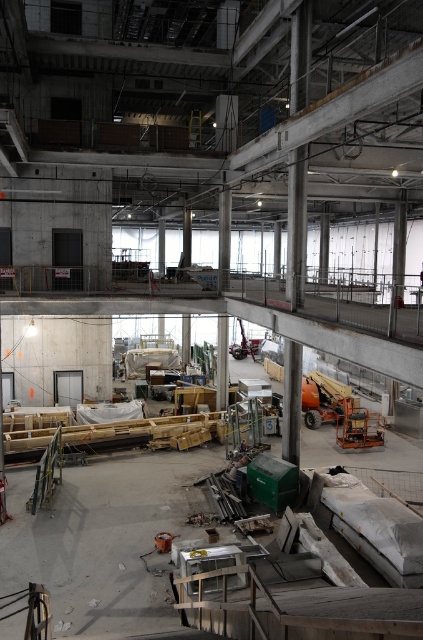
From the picture: You are standing at the entrance of the construction site and need to locate the concrete floor at center. According to the coordinates provided, where should you look to find it?

The concrete floor at center is located at point [106,538].

You are standing at the point marked by coordinates point (106, 538) in this industrial construction site. What is the surface you are currently standing on?

The surface you are standing on is the concrete floor at center, as the point (106, 538) represents the concrete floor at center.